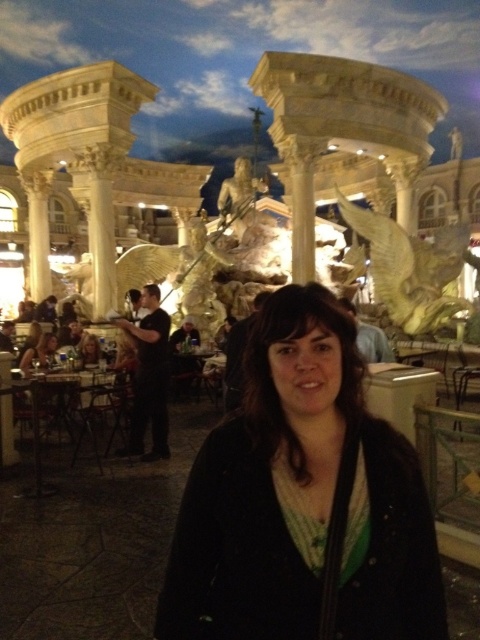
You are a photographer trying to capture the woman in the scene. Since you want to focus on her clothing, which object should you adjust your camera focus on, the black matte jacket at center or the matte black hair at lower center?

The black matte jacket at center is larger in size than the matte black hair at lower center, so you should focus on the black matte jacket at center to ensure it is the main subject in the photograph.

You are standing at the point with coordinates point (50, 333) and want to walk towards the fountain in the background. Is the point (394, 541) blocking your path?

Point (394, 541) is in front of point (50, 333), so yes, the point (394, 541) is blocking your path.